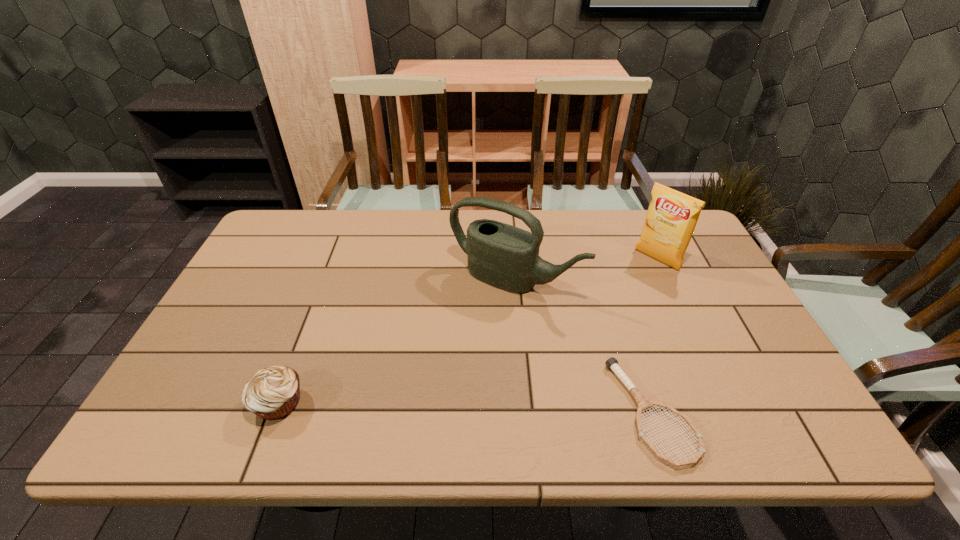
Locate an element on the screen. Image resolution: width=960 pixels, height=540 pixels. vacant area situated on the front of the crisp (potato chip) with the logo is located at coordinates (609, 302).

Identify the location of vacant space located on the spout of the watering can. (418, 385).

I want to click on free space located 0.310m on the spout of the watering can, so click(x=415, y=388).

Locate an element on the screen. The width and height of the screenshot is (960, 540). vacant space located 0.280m on the spout of the watering can is located at coordinates (422, 379).

Where is `object present at the far edge`? The width and height of the screenshot is (960, 540). object present at the far edge is located at coordinates (672, 216).

The width and height of the screenshot is (960, 540). What are the coordinates of `muffin that is at the near edge` in the screenshot? It's located at (272, 393).

I want to click on tennis racket that is at the near edge, so click(644, 403).

This screenshot has width=960, height=540. Identify the location of object that is at the right edge. (672, 216).

The height and width of the screenshot is (540, 960). What are the coordinates of `object positioned at the far right corner` in the screenshot? It's located at (672, 216).

Where is `vacant space at the far edge of the desktop`? The width and height of the screenshot is (960, 540). vacant space at the far edge of the desktop is located at coordinates (381, 249).